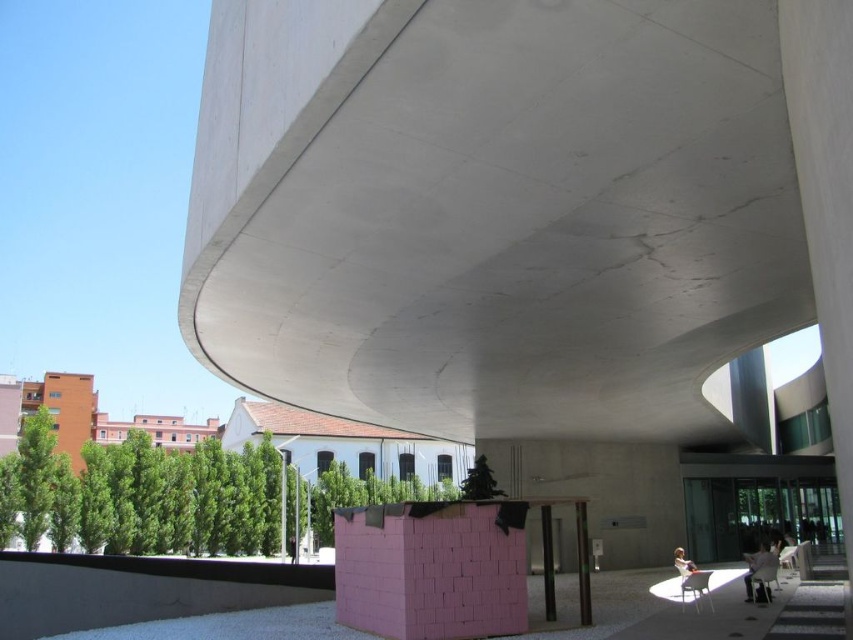
Question: Which object is the farthest from the pink foam block at center?

Choices:
 (A) smooth gray pillar at center
 (B) green matte tree at center
 (C) green leafy tree at lower left

Answer: (C)

Question: Does smooth concrete pillar at center lie behind green matte tree at center?

Choices:
 (A) no
 (B) yes

Answer: (A)

Question: Estimate the real-world distances between objects in this image. Which object is farther from the pink foam block at center?

Choices:
 (A) smooth gray pillar at center
 (B) green matte tree at center

Answer: (B)

Question: Does green leafy tree at lower left appear on the left side of green matte tree at center?

Choices:
 (A) yes
 (B) no

Answer: (A)

Question: Can you confirm if pink foam block at center is wider than smooth concrete pillar at center?

Choices:
 (A) no
 (B) yes

Answer: (B)

Question: Which of the following is the farthest from the observer?

Choices:
 (A) (581, 611)
 (B) (22, 456)
 (C) (496, 486)

Answer: (B)